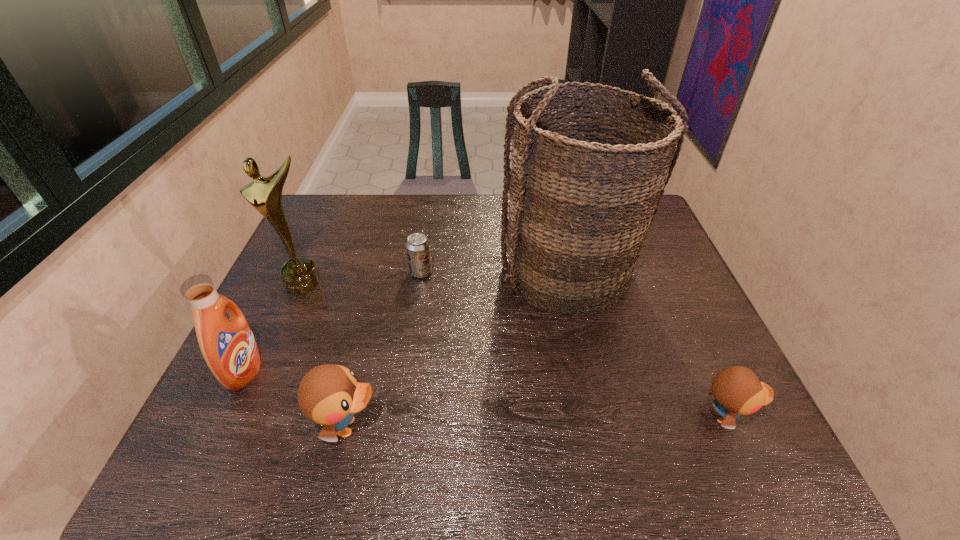
Where is `object that is at the near left corner`? object that is at the near left corner is located at coordinates (228, 346).

Identify the location of object present at the near right corner. Image resolution: width=960 pixels, height=540 pixels. (737, 390).

Identify the location of vacant point at the far edge. The width and height of the screenshot is (960, 540). (468, 197).

Identify the location of free region at the left edge. This screenshot has height=540, width=960. (294, 314).

Find the location of a particular element. This screenshot has height=540, width=960. free region at the right edge of the desktop is located at coordinates (673, 360).

This screenshot has width=960, height=540. In the image, there is a desktop. In order to click on vacant space at the far left corner in this screenshot , I will do `click(332, 202)`.

I want to click on vacant area at the near left corner, so click(x=230, y=392).

Find the location of a particular element. Image resolution: width=960 pixels, height=540 pixels. free space at the near right corner of the desktop is located at coordinates (703, 399).

Identify the location of empty location between the fifth shortest object and the third shortest object. (325, 355).

Find the location of a particular element. free spot between the second shortest object and the shortest object is located at coordinates coord(573,345).